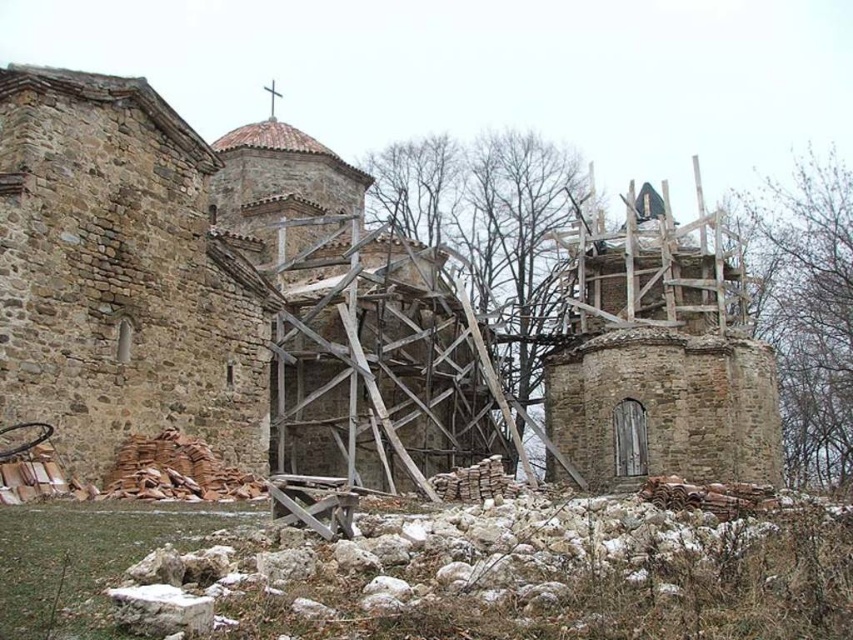
Is stone church at center below stone rubble at right?

Indeed, stone church at center is positioned under stone rubble at right.

Does stone church at center appear on the right side of stone rubble at right?

In fact, stone church at center is to the left of stone rubble at right.

Measure the distance between stone church at center and camera.

stone church at center and camera are 36.88 meters apart.

Where is `stone church at center`? This screenshot has height=640, width=853. stone church at center is located at coordinates (339, 316).